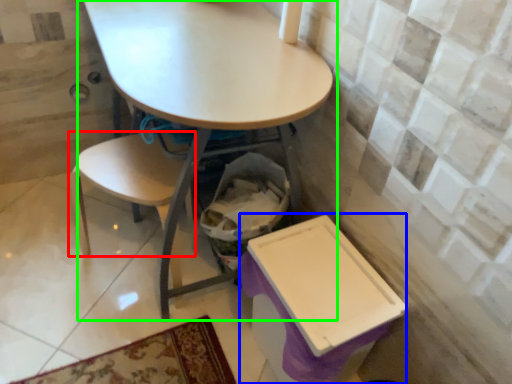
Question: Based on their relative distances, which object is nearer to chair (highlighted by a red box)? Choose from box (highlighted by a blue box) and table (highlighted by a green box).

Choices:
 (A) box
 (B) table

Answer: (B)